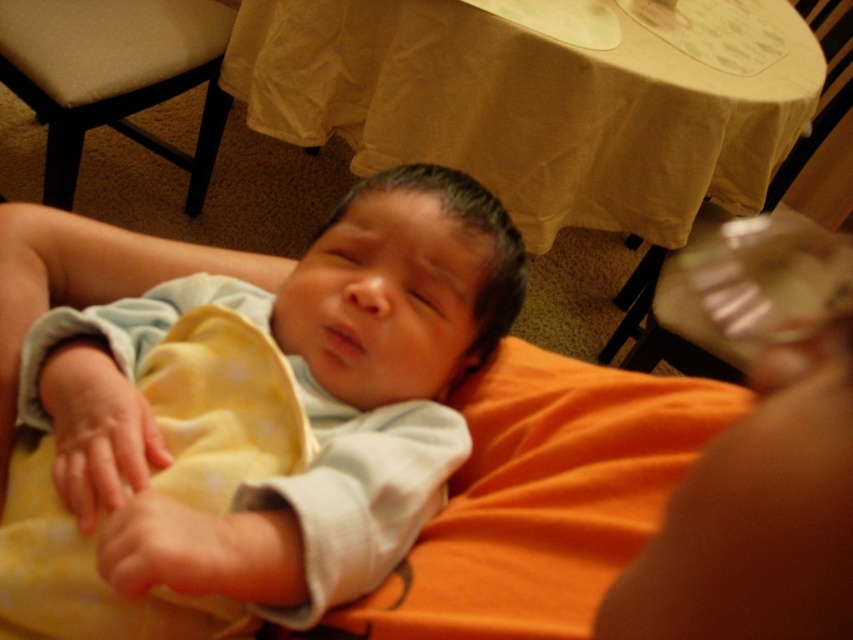
Does beige fabric tablecloth at upper center appear under transparent plastic cup at upper right?

Correct, beige fabric tablecloth at upper center is located below transparent plastic cup at upper right.

You are a GUI agent. You are given a task and a screenshot of the screen. Output one action in this format:
    pyautogui.click(x=<x>, y=<y>)
    Task: Click on the beige fabric tablecloth at upper center
    The image size is (853, 640).
    Given the screenshot: What is the action you would take?
    pyautogui.click(x=529, y=106)

In order to click on beige fabric tablecloth at upper center in this screenshot , I will do `click(529, 106)`.

Between point (549, 84) and point (32, 65), which one is positioned behind?

Point (32, 65)

Is point (659, 113) positioned before point (48, 22)?

Yes, point (659, 113) is closer to viewer.

Is point (305, 116) more distant than point (33, 49)?

That is True.

Where is `beige fabric tablecloth at upper center`? Image resolution: width=853 pixels, height=640 pixels. beige fabric tablecloth at upper center is located at coordinates (529, 106).

Can you confirm if soft yellow cloth at lower left is shorter than smooth yellow cloth at lower left?

Incorrect, soft yellow cloth at lower left's height does not fall short of smooth yellow cloth at lower left's.

Who is shorter, soft yellow cloth at lower left or smooth yellow cloth at lower left?

With less height is smooth yellow cloth at lower left.

Which is in front, point (99, 490) or point (115, 536)?

Positioned in front is point (115, 536).

This screenshot has height=640, width=853. I want to click on soft yellow cloth at lower left, so click(x=97, y=432).